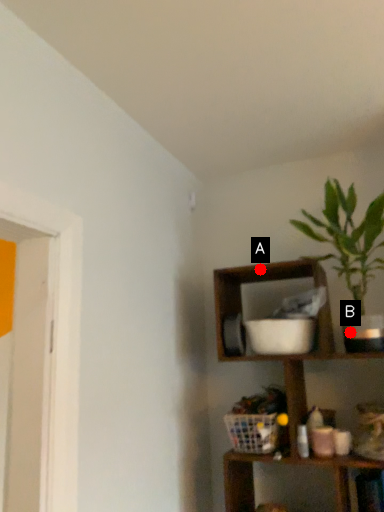
Question: Two points are circled on the image, labeled by A and B beside each circle. Which point appears farthest from the camera in this image?

Choices:
 (A) A is further
 (B) B is further

Answer: (A)